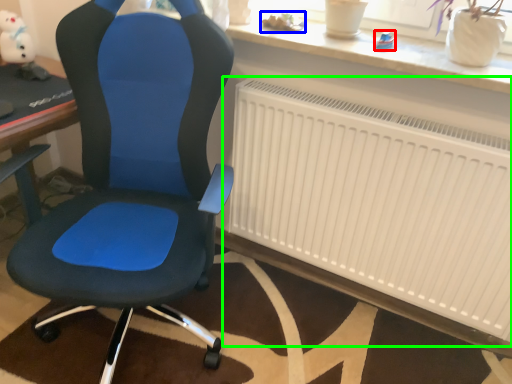
Question: Which object is the farthest from toy (highlighted by a red box)? Choose among these: toy (highlighted by a blue box) or radiator (highlighted by a green box).

Choices:
 (A) toy
 (B) radiator

Answer: (B)